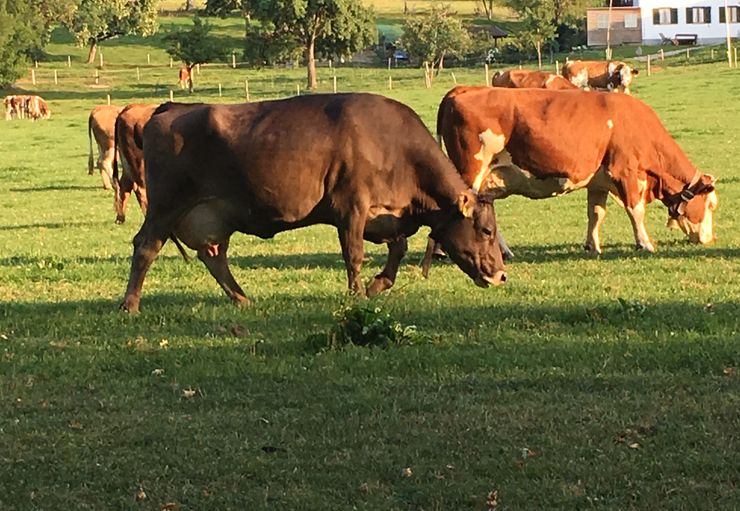
Where is `shutters`? shutters is located at coordinates (653, 15), (673, 9), (687, 14), (706, 12), (721, 14), (736, 14).